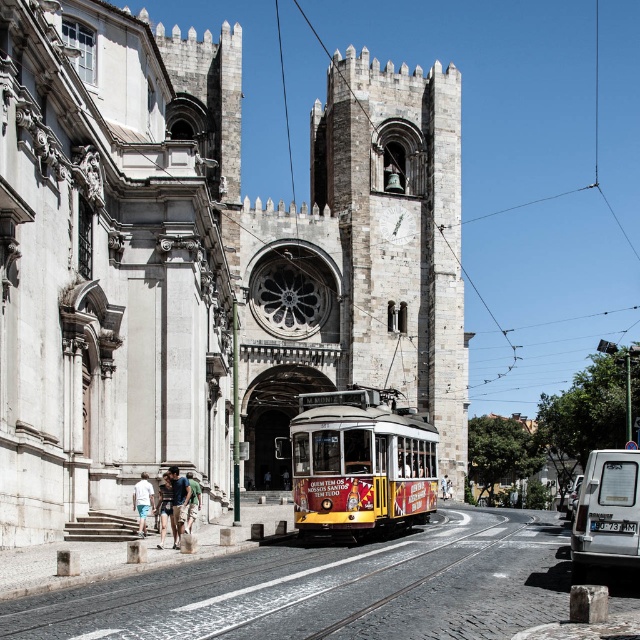
Question: Which of the following is the farthest from the observer?

Choices:
 (A) light brown leather jacket at center
 (B) white matte van at lower right

Answer: (A)

Question: Among these objects, which one is nearest to the camera?

Choices:
 (A) gray stone tower at center
 (B) white matte van at lower right

Answer: (B)

Question: Does white cotton shorts at lower left appear over silver metallic van at lower right?

Choices:
 (A) yes
 (B) no

Answer: (A)

Question: Estimate the real-world distances between objects in this image. Which object is farther from the stone church at center?

Choices:
 (A) silver metallic van at lower right
 (B) yellow polished metal tram at center

Answer: (A)

Question: Observing the image, what is the correct spatial positioning of white cotton shorts at lower left in reference to silver metallic van at lower right?

Choices:
 (A) left
 (B) right

Answer: (A)

Question: Is denim shorts at lower center below silver metallic van at lower right?

Choices:
 (A) no
 (B) yes

Answer: (A)